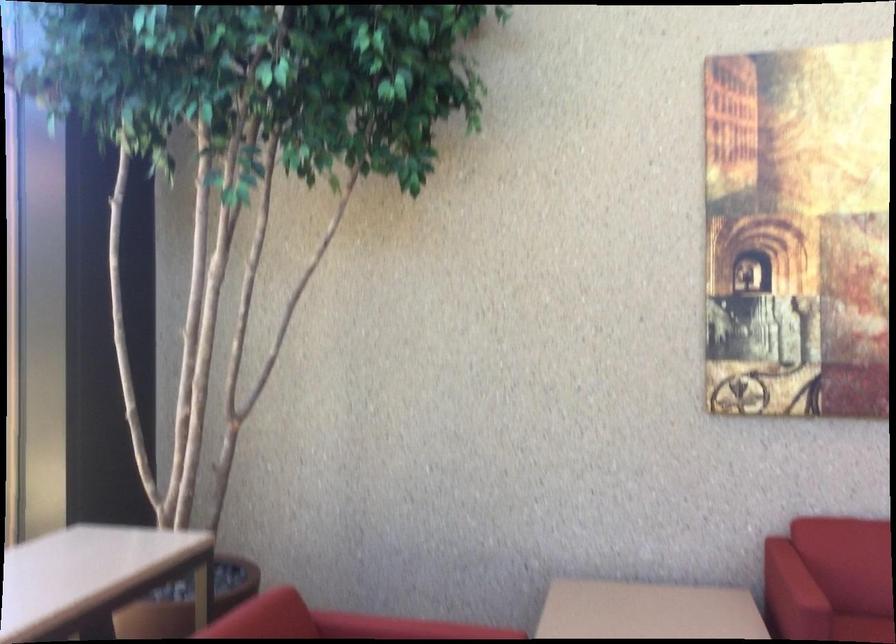
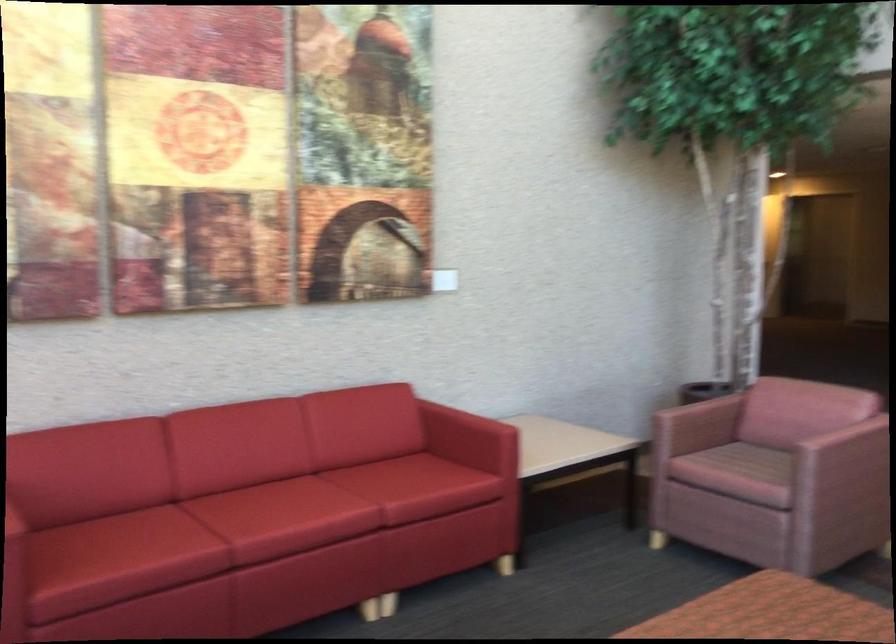
Question: The camera is either moving clockwise (left) or counter-clockwise (right) around the object. The first image is from the beginning of the video and the second image is from the end. Is the camera moving left or right when shooting the video?

Choices:
 (A) Left
 (B) Right

Answer: (A)